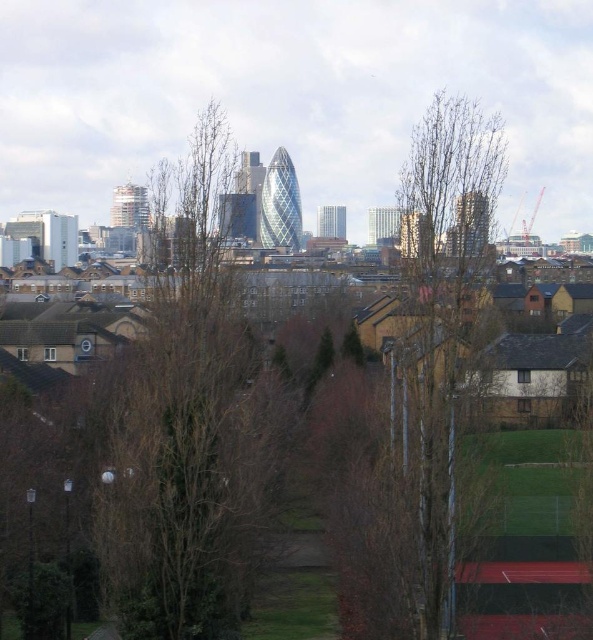
Question: Can you confirm if bare branches at center is thinner than bare wood tree at center?

Choices:
 (A) yes
 (B) no

Answer: (B)

Question: Does bare branches at center lie behind bare wood tree at center?

Choices:
 (A) yes
 (B) no

Answer: (A)

Question: Which of the following is the farthest from the observer?

Choices:
 (A) bare branches at center
 (B) bare wood tree at center

Answer: (A)

Question: Does bare branches at center have a smaller size compared to bare wood tree at center?

Choices:
 (A) yes
 (B) no

Answer: (B)

Question: Which point is closer to the camera taking this photo?

Choices:
 (A) (436, 438)
 (B) (129, 518)

Answer: (A)